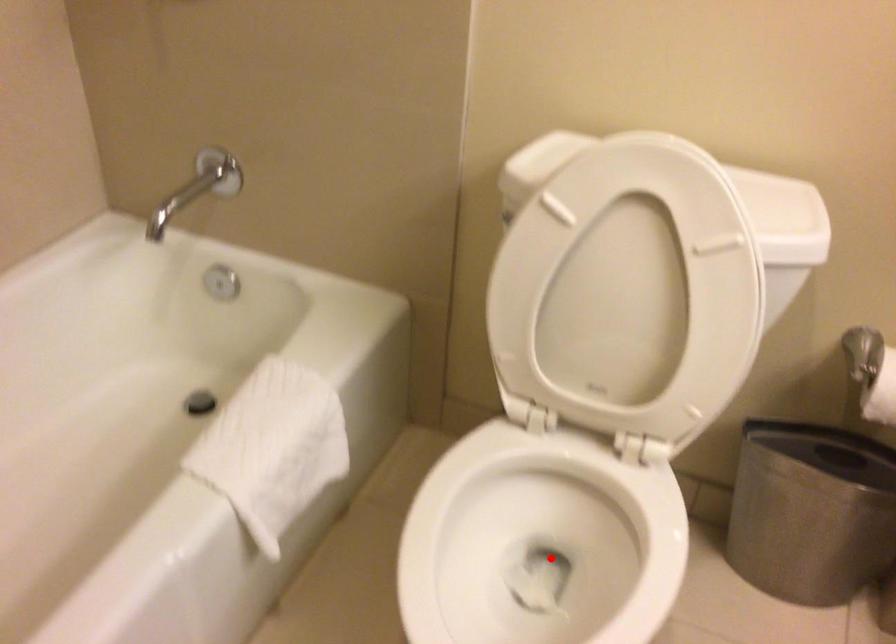
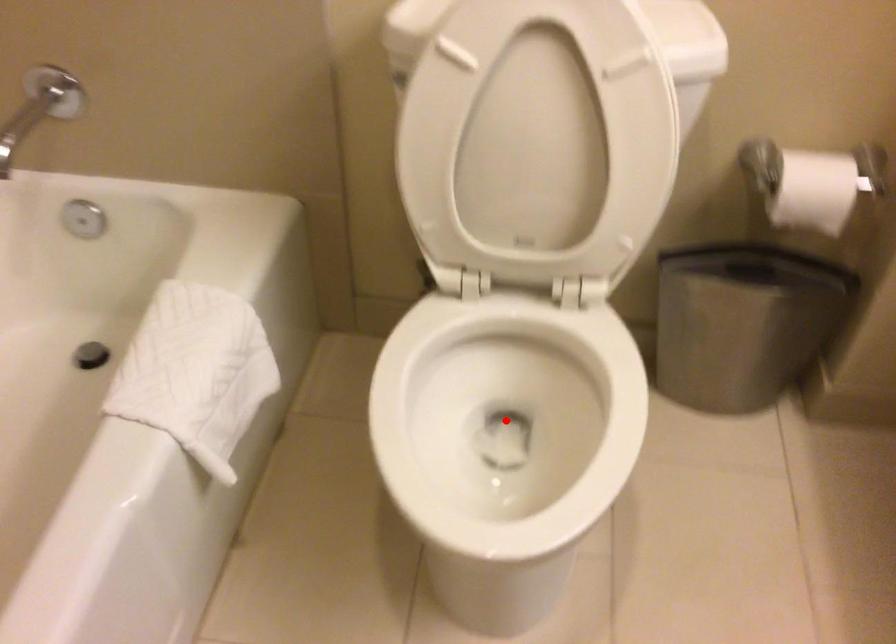
I am providing you with two images of the same scene from different viewpoints. A red point is marked on the first image and another point is marked on the second image. Does the point marked in image1 correspond to the same location as the one in image2?

Yes